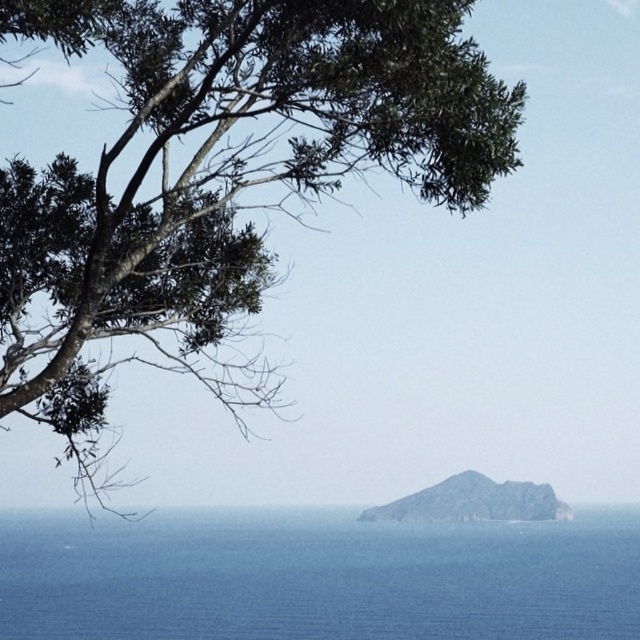
The height and width of the screenshot is (640, 640). Find the location of `green leafy tree at upper left`. green leafy tree at upper left is located at coordinates (220, 180).

Is green leafy tree at upper left below rugged stone island at center?

Incorrect, green leafy tree at upper left is not positioned below rugged stone island at center.

Between green leafy tree at upper left and rugged stone island at center, which one has more height?

Standing taller between the two is green leafy tree at upper left.

The width and height of the screenshot is (640, 640). What do you see at coordinates (220, 180) in the screenshot?
I see `green leafy tree at upper left` at bounding box center [220, 180].

Image resolution: width=640 pixels, height=640 pixels. I want to click on green leafy tree at upper left, so click(220, 180).

Can you confirm if blue water at center is smaller than rugged stone island at center?

Actually, blue water at center might be larger than rugged stone island at center.

Is blue water at center above rugged stone island at center?

Actually, blue water at center is below rugged stone island at center.

Between point (198, 564) and point (400, 512), which one is positioned behind?

Point (400, 512)

You are a GUI agent. You are given a task and a screenshot of the screen. Output one action in this format:
    pyautogui.click(x=<x>, y=<y>)
    Task: Click on the blue water at center
    
    Given the screenshot: What is the action you would take?
    pyautogui.click(x=317, y=577)